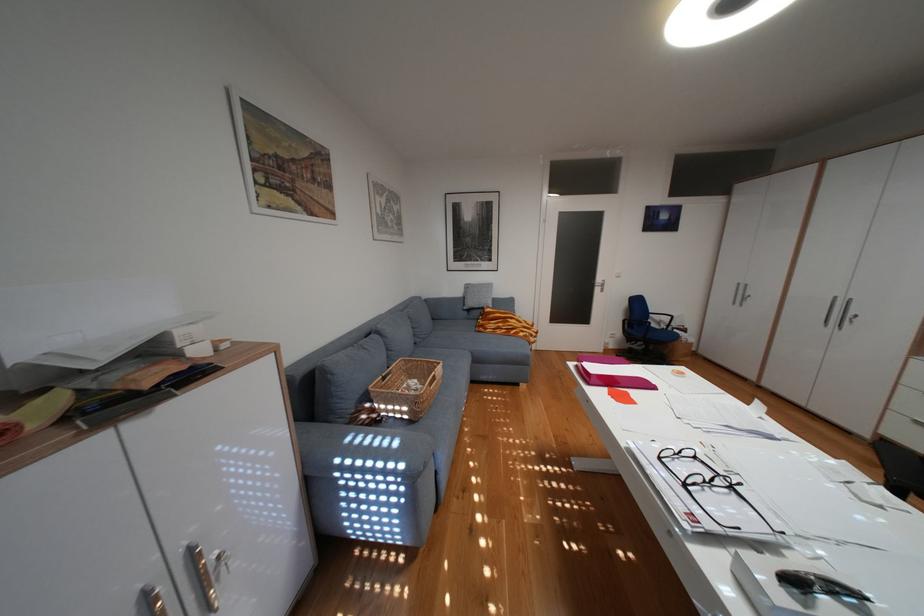
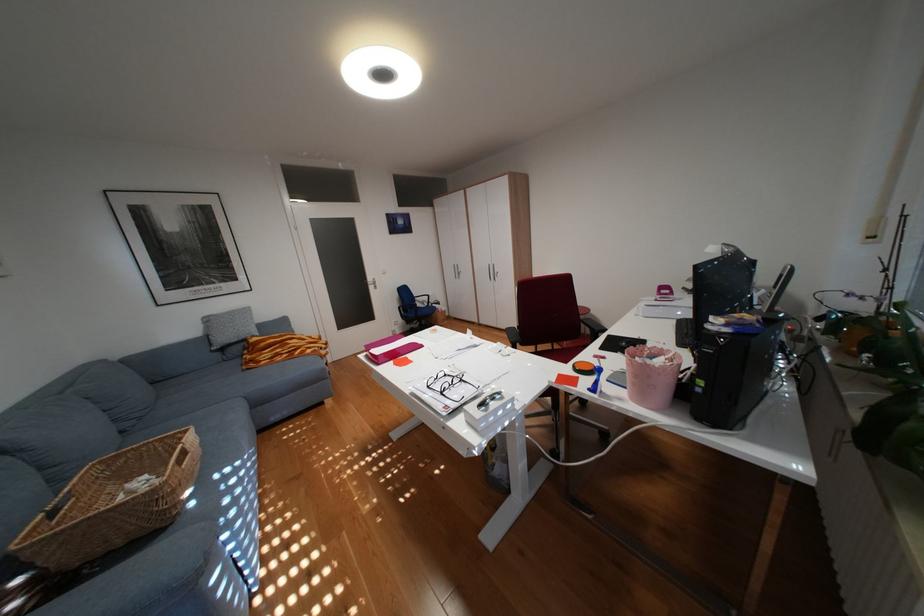
The point at (698,485) is marked in the first image. Where is the corresponding point in the second image?

(454, 392)